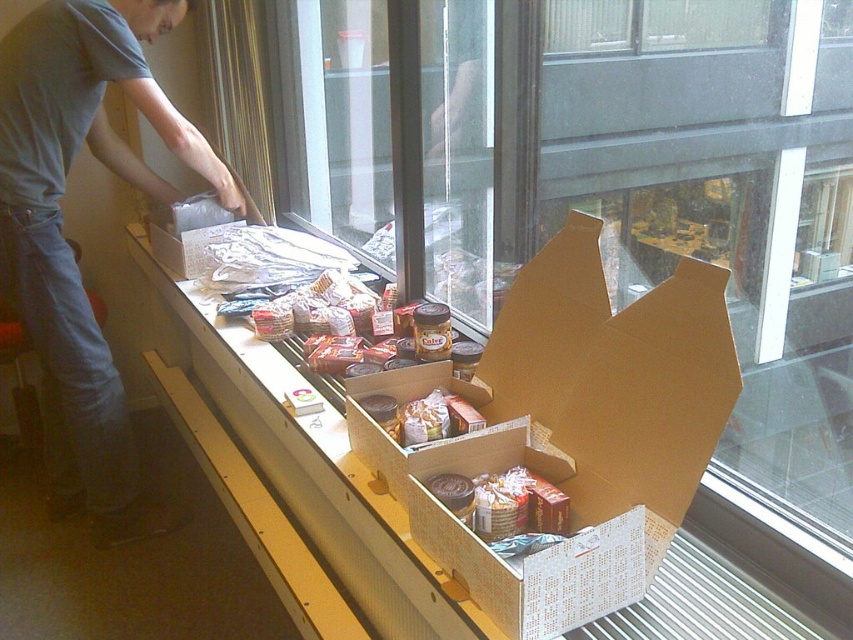
Can you confirm if brown cardboard box at center is taller than shiny metallic can at center?

Correct, brown cardboard box at center is much taller as shiny metallic can at center.

Between point (611, 328) and point (456, 476), which one is positioned behind?

The point (611, 328) is more distant.

Where is `brown cardboard box at center`? The height and width of the screenshot is (640, 853). brown cardboard box at center is located at coordinates (572, 429).

Does shiny metallic can at center have a smaller size compared to matte plastic bag of chips at center?

No.

Does point (538, 477) lie in front of point (424, 428)?

Yes, point (538, 477) is closer to viewer.

Identify the location of shiny metallic can at center. (503, 504).

Is gray cotton shirt at upper left in front of shiny metallic can at center?

No, it is behind shiny metallic can at center.

Between point (100, 49) and point (515, 528), which one is positioned behind?

The point (100, 49) is more distant.

Find the location of `gray cotton shirt at upper left`. gray cotton shirt at upper left is located at coordinates (64, 237).